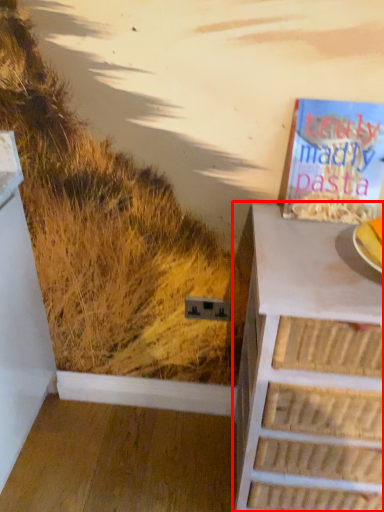
Question: From the image's perspective, considering the relative positions of chest of drawers (annotated by the red box) and book in the image provided, where is chest of drawers (annotated by the red box) located with respect to the staircase?

Choices:
 (A) below
 (B) above

Answer: (A)